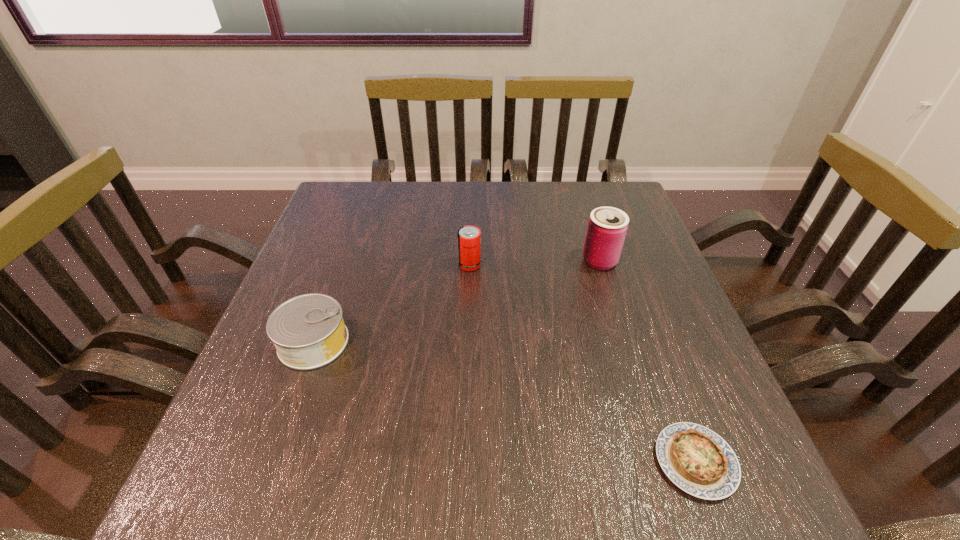
The image size is (960, 540). Find the location of `the tallest object`. the tallest object is located at coordinates (607, 227).

The width and height of the screenshot is (960, 540). I want to click on the tallest can, so click(607, 227).

Locate an element on the screen. Image resolution: width=960 pixels, height=540 pixels. the second object from left to right is located at coordinates (469, 237).

I want to click on the second tallest object, so click(469, 237).

Image resolution: width=960 pixels, height=540 pixels. Identify the location of the nearest can. (308, 331).

Locate an element on the screen. the shortest can is located at coordinates (308, 331).

Locate an element on the screen. the shortest object is located at coordinates (697, 460).

The width and height of the screenshot is (960, 540). Identify the location of quiche. (697, 460).

Find the location of a particular element. The height and width of the screenshot is (540, 960). free spot located 0.220m on the back of the tallest can is located at coordinates (582, 202).

Image resolution: width=960 pixels, height=540 pixels. I want to click on vacant region located on the left of the second shortest can, so click(x=393, y=265).